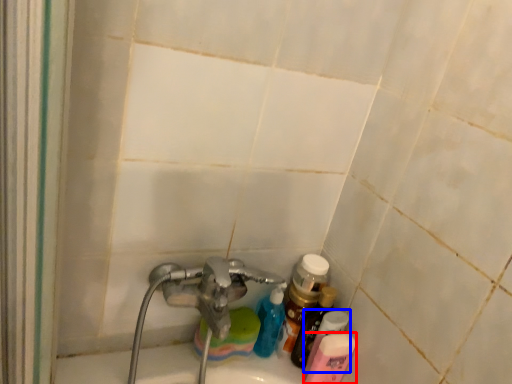
Question: Among these objects, which one is nearest to the camera, toiletry (highlighted by a red box) or toiletry (highlighted by a blue box)?

Choices:
 (A) toiletry
 (B) toiletry

Answer: (A)